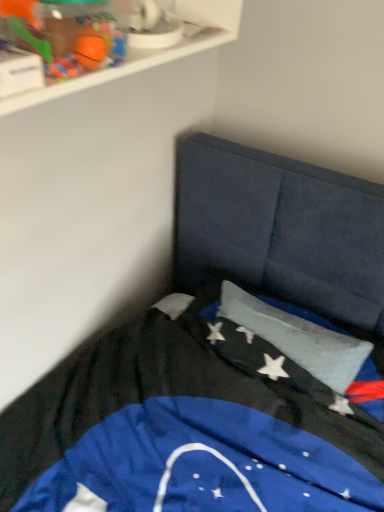
Question: From a real-world perspective, is white plastic shelf at upper left physically located above or below rubberized orange ball at upper left?

Choices:
 (A) above
 (B) below

Answer: (B)

Question: Is white plastic shelf at upper left to the left or to the right of rubberized orange ball at upper left in the image?

Choices:
 (A) right
 (B) left

Answer: (A)

Question: Which object is the farthest from the rubberized orange ball at upper left?

Choices:
 (A) silky blue flag at center
 (B) white plastic shelf at upper left

Answer: (A)

Question: Considering the real-world distances, which object is farthest from the silky blue flag at center?

Choices:
 (A) white plastic shelf at upper left
 (B) rubberized orange ball at upper left

Answer: (B)